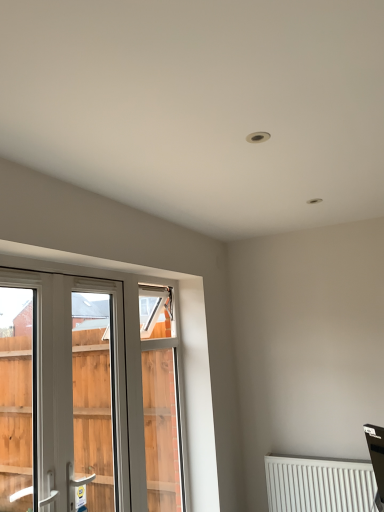
Question: From the image's perspective, is white plastic window at left located above or below white plastic screen door at left?

Choices:
 (A) above
 (B) below

Answer: (A)

Question: Would you say white plastic window at left is inside or outside white plastic screen door at left?

Choices:
 (A) outside
 (B) inside

Answer: (B)

Question: Estimate the real-world distances between objects in this image. Which object is closer to the white plastic screen door at left?

Choices:
 (A) white matte radiator at lower right
 (B) white plastic window at left

Answer: (B)

Question: Which of these objects is positioned farthest from the white plastic screen door at left?

Choices:
 (A) white plastic window at left
 (B) white matte radiator at lower right

Answer: (B)